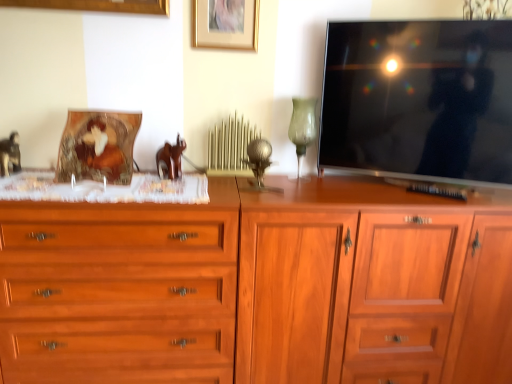
Identify the location of vacant area in front of metallic silver table lamp at center, placed as the second table lamp when sorted from right to left. (262, 196).